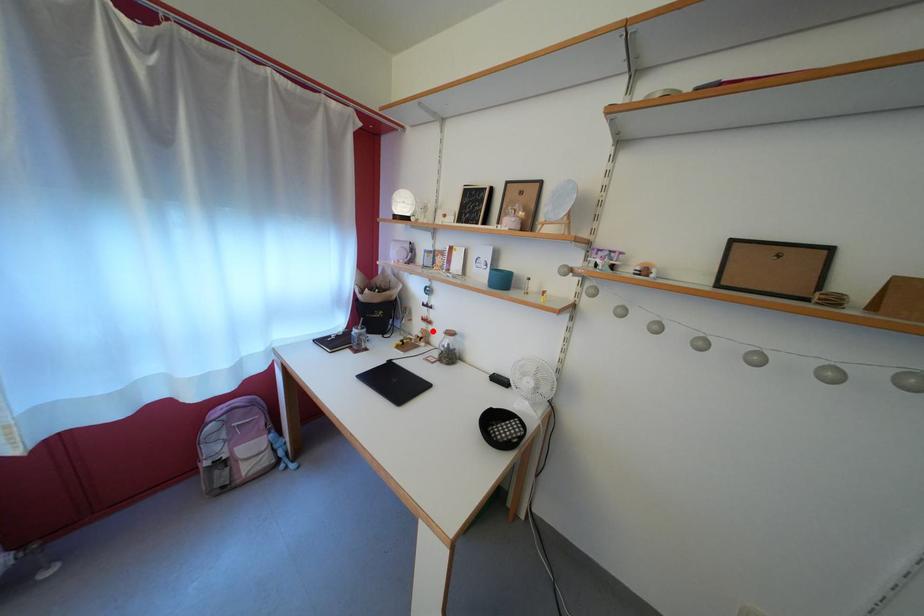
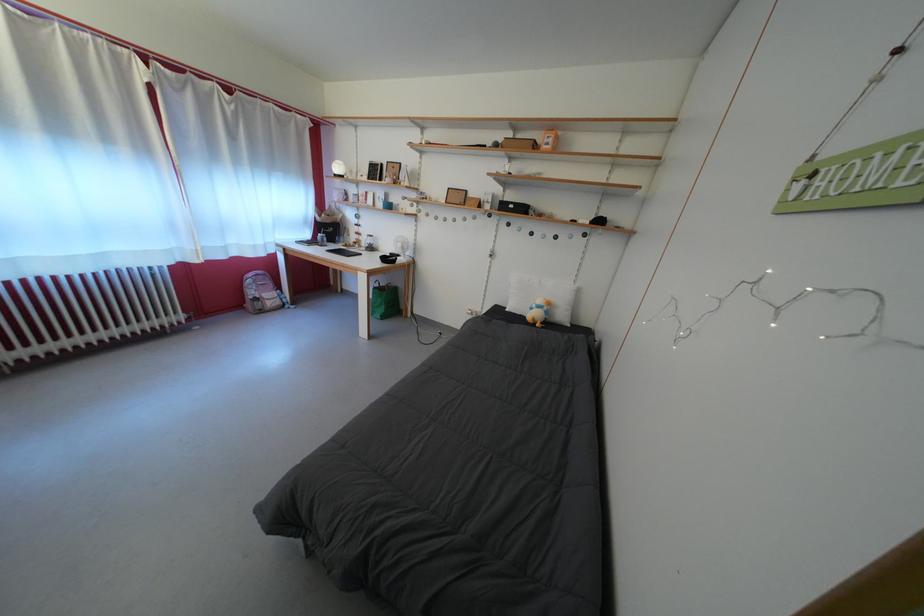
Question: I am providing you with two images of the same scene from different viewpoints. Image1 has a red point marked. In image2, the corresponding 3D location appears at what relative position? Reply with the corresponding letter.

Choices:
 (A) Closer
 (B) Farther

Answer: (A)